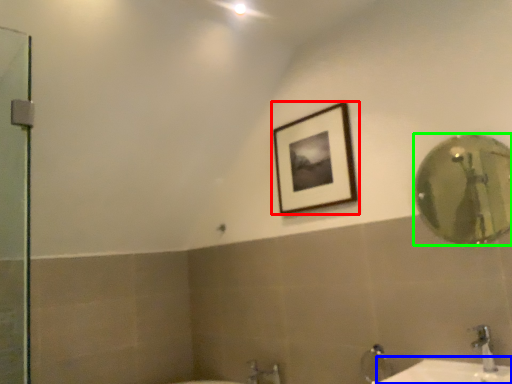
Question: Considering the real-world distances, which object is closest to picture frame (highlighted by a red box)? counter top (highlighted by a blue box) or mirror (highlighted by a green box).

Choices:
 (A) counter top
 (B) mirror

Answer: (A)